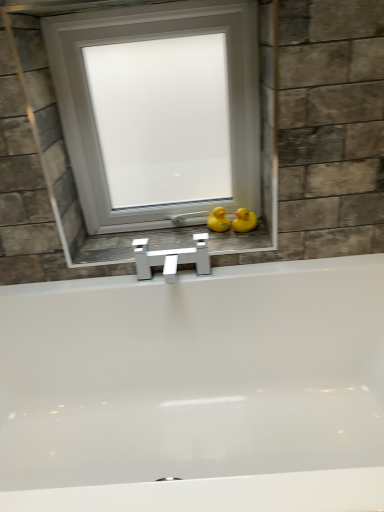
At what (x,y) coordinates should I click in order to perform the action: click on vacant area that lies in front of yellow rubber duck at right, the first duck when ordered from right to left. Please return your answer as a coordinate pair (x, y). This screenshot has width=384, height=512. Looking at the image, I should click on (245, 241).